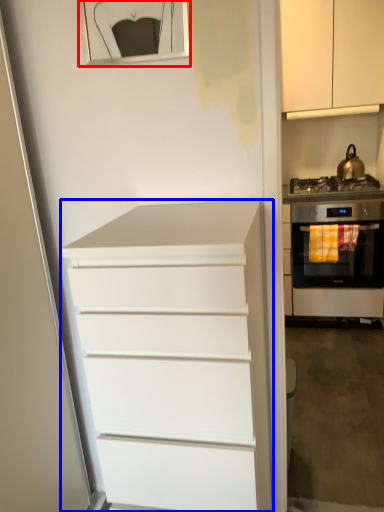
Question: Which point is further to the camera, picture frame (highlighted by a red box) or chest of drawers (highlighted by a blue box)?

Choices:
 (A) picture frame
 (B) chest of drawers

Answer: (A)